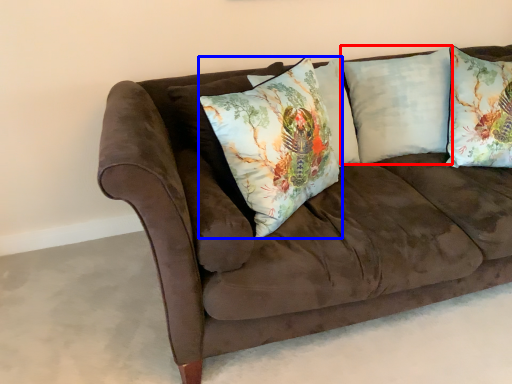
Question: Among these objects, which one is nearest to the camera, pillow (highlighted by a red box) or pillow (highlighted by a blue box)?

Choices:
 (A) pillow
 (B) pillow

Answer: (B)